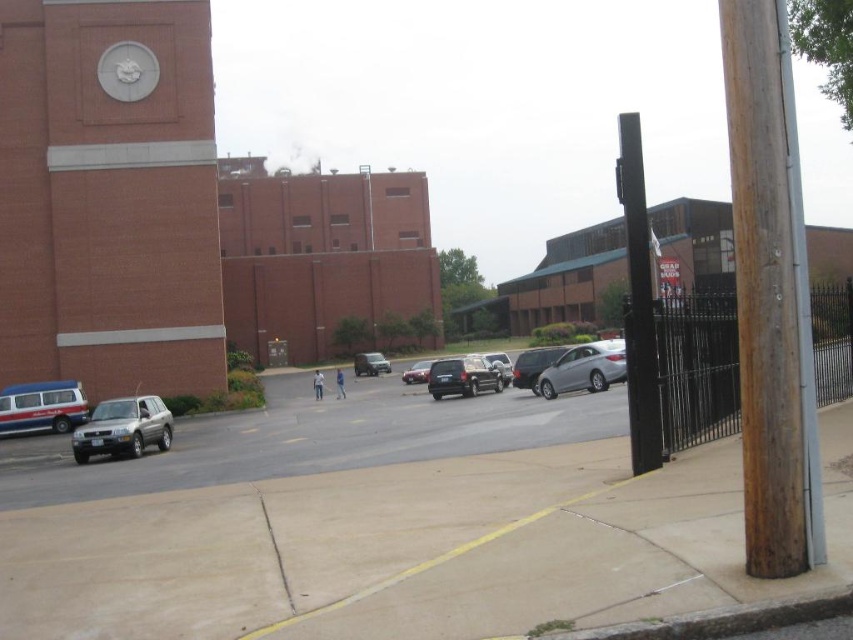
Question: Based on their relative distances, which object is farther from the white matte van at lower left?

Choices:
 (A) satin silver minivan at center
 (B) silver metallic suv at lower left
 (C) satin silver suv at lower left

Answer: (A)

Question: Does satin silver suv at lower left have a greater width compared to white matte van at lower left?

Choices:
 (A) yes
 (B) no

Answer: (A)

Question: Among these objects, which one is nearest to the camera?

Choices:
 (A) shiny silver sedan at center
 (B) satin silver minivan at center
 (C) white matte clock at upper left
 (D) brick clock tower at upper left

Answer: (D)

Question: Among these objects, which one is nearest to the camera?

Choices:
 (A) brown wooden pole at right
 (B) white matte van at lower left

Answer: (A)

Question: Does brown wooden pole at right lie behind shiny silver sedan at center?

Choices:
 (A) no
 (B) yes

Answer: (A)

Question: Is the position of brown wooden pole at right less distant than that of white matte clock at upper left?

Choices:
 (A) yes
 (B) no

Answer: (A)